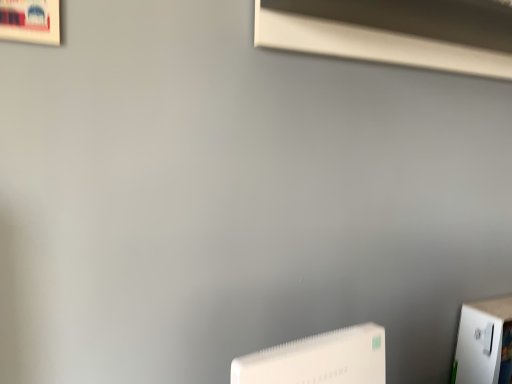
Question: From a real-world perspective, is white smooth window sill at upper center positioned under white plastic wii at lower center based on gravity?

Choices:
 (A) yes
 (B) no

Answer: (B)

Question: Is white smooth window sill at upper center positioned far away from white plastic wii at lower center?

Choices:
 (A) yes
 (B) no

Answer: (B)

Question: Does white smooth window sill at upper center have a smaller size compared to white plastic wii at lower center?

Choices:
 (A) no
 (B) yes

Answer: (A)

Question: Is white smooth window sill at upper center bigger than white plastic wii at lower center?

Choices:
 (A) yes
 (B) no

Answer: (A)

Question: Does white smooth window sill at upper center lie in front of white plastic wii at lower center?

Choices:
 (A) no
 (B) yes

Answer: (A)

Question: Could you tell me if white smooth window sill at upper center is facing white plastic wii at lower center?

Choices:
 (A) yes
 (B) no

Answer: (B)

Question: Does white plastic wii at lower center have a lesser width compared to white smooth window sill at upper center?

Choices:
 (A) no
 (B) yes

Answer: (B)

Question: Is white plastic wii at lower center positioned in front of white smooth window sill at upper center?

Choices:
 (A) yes
 (B) no

Answer: (A)

Question: Is white plastic wii at lower center wider than white smooth window sill at upper center?

Choices:
 (A) no
 (B) yes

Answer: (A)

Question: From the image's perspective, is white plastic wii at lower center under white smooth window sill at upper center?

Choices:
 (A) yes
 (B) no

Answer: (A)

Question: From a real-world perspective, does white plastic wii at lower center stand above white smooth window sill at upper center?

Choices:
 (A) yes
 (B) no

Answer: (B)

Question: Can you confirm if white plastic wii at lower center is positioned to the left of white smooth window sill at upper center?

Choices:
 (A) yes
 (B) no

Answer: (A)

Question: In the image, is white plastic wii at lower center positioned in front of or behind white smooth window sill at upper center?

Choices:
 (A) behind
 (B) front

Answer: (B)